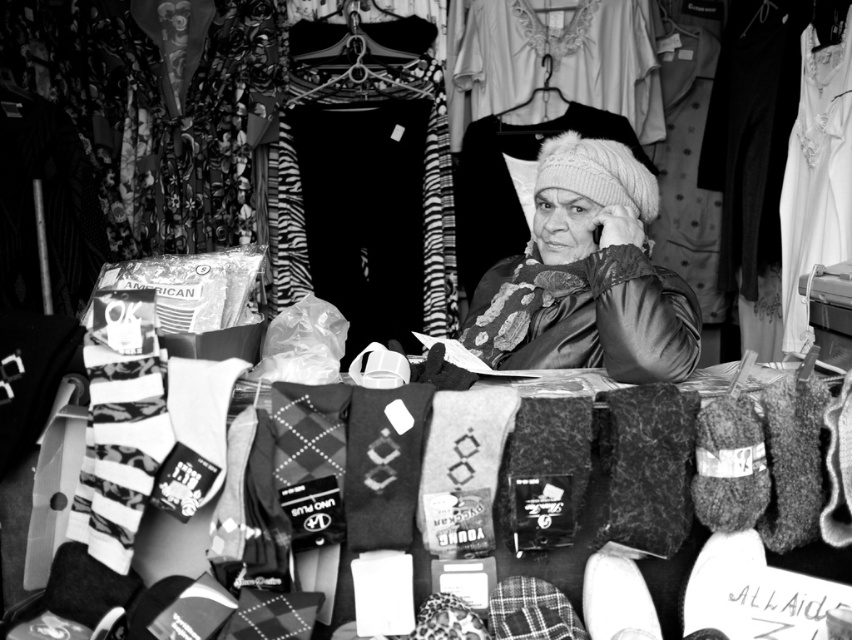
You are a customer at the market stall and want to pick up two items from the table. The first item is at point [484,316] and the second item is at point [607,33]. Which item should you reach for first to minimize the distance you need to move your hand?

You should reach for the item at point [484,316] first because it is closer to you than the item at point [607,33].